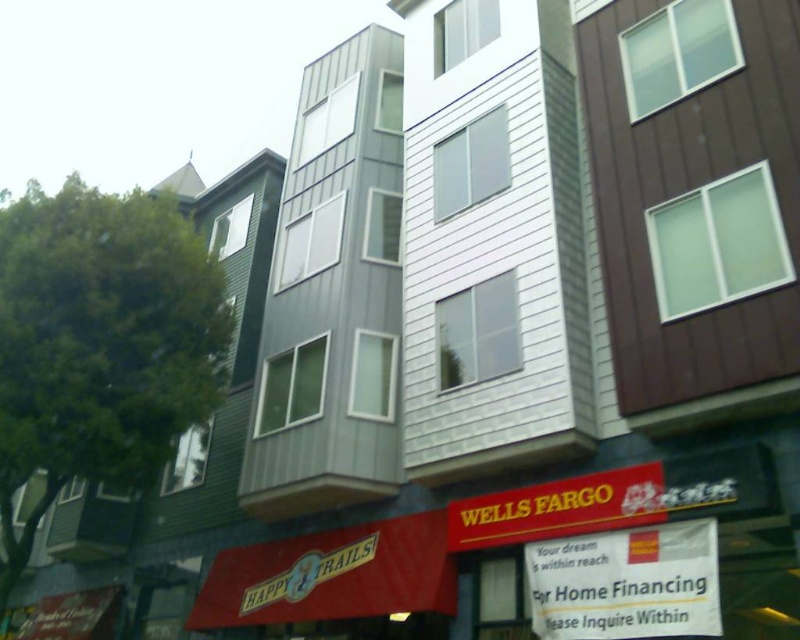
Question: Can you confirm if white paper sign at lower center is positioned to the left of yellow matte sign at lower center?

Choices:
 (A) no
 (B) yes

Answer: (A)

Question: Does white paper sign at lower center appear on the right side of yellow matte sign at lower center?

Choices:
 (A) yes
 (B) no

Answer: (A)

Question: Is white paper sign at lower center behind yellow matte sign at lower center?

Choices:
 (A) no
 (B) yes

Answer: (A)

Question: Which point appears farthest from the camera in this image?

Choices:
 (A) (676, 548)
 (B) (625, 502)

Answer: (B)

Question: Which of the following is the farthest from the observer?

Choices:
 (A) (698, 588)
 (B) (540, 520)

Answer: (B)

Question: Which point is closer to the camera taking this photo?

Choices:
 (A) (501, 493)
 (B) (641, 536)

Answer: (B)